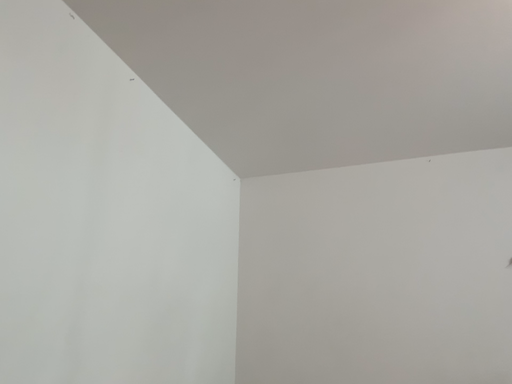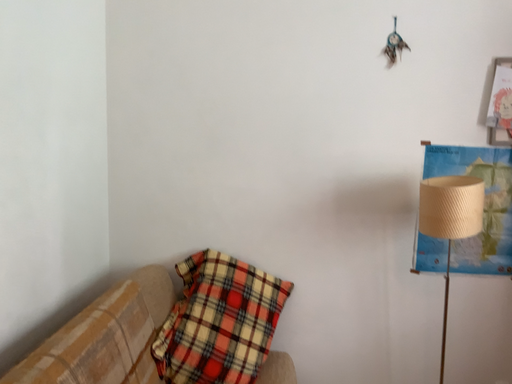
Question: How did the camera likely rotate when shooting the video?

Choices:
 (A) rotated downward
 (B) rotated upward

Answer: (A)